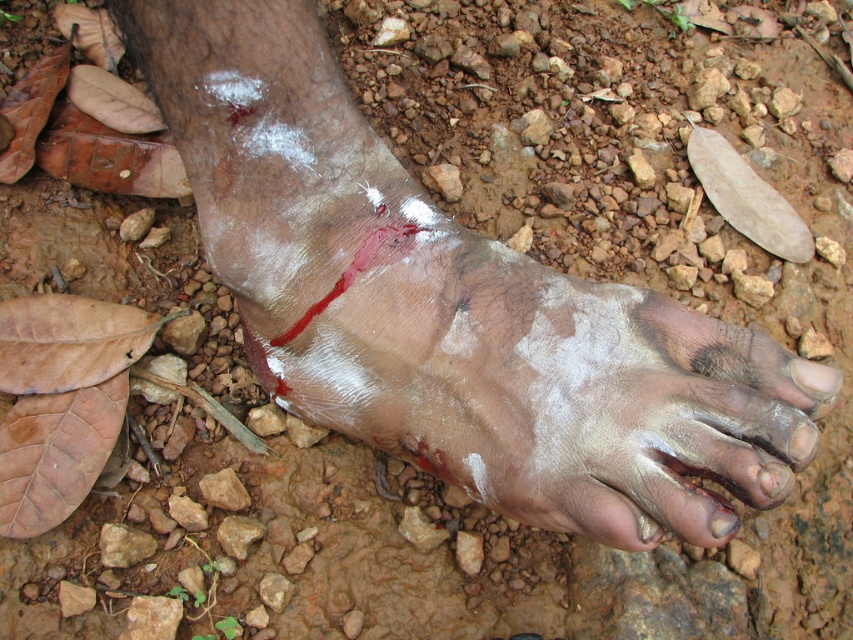
You are a hiker who just twisted your ankle while walking on a rocky trail. You notice two areas on your foot that are injured. One is the scabbed skin foot at center and the other is the pale skin toe at center. Which of these injuries is bigger?

The scabbed skin foot at center is larger in size than the pale skin toe at center, so the scabbed skin foot at center is bigger.

You are a hiker who has just noticed your foot injury. You see the scabbed skin foot at center. Based on its position, can you determine if it is closer to the rocks or the leaves on the ground?

The scabbed skin foot at center is located at point (450, 305). Since the coordinates are in the center of the image, it is equidistant to both rocks and leaves, but the description mentions the foot is on ground with small rocks and scattered leaves, so the foot is in an area with both rocks and leaves around it.

You are a hiker who has just noticed your foot injury. You see the scabbed skin foot at center. Based on its position, can you determine if it is more towards the left or right side of your view?

The scabbed skin foot at center is located at point (x=450, y=305), which places it near the center of the view, so it is neither more to the left nor right side.